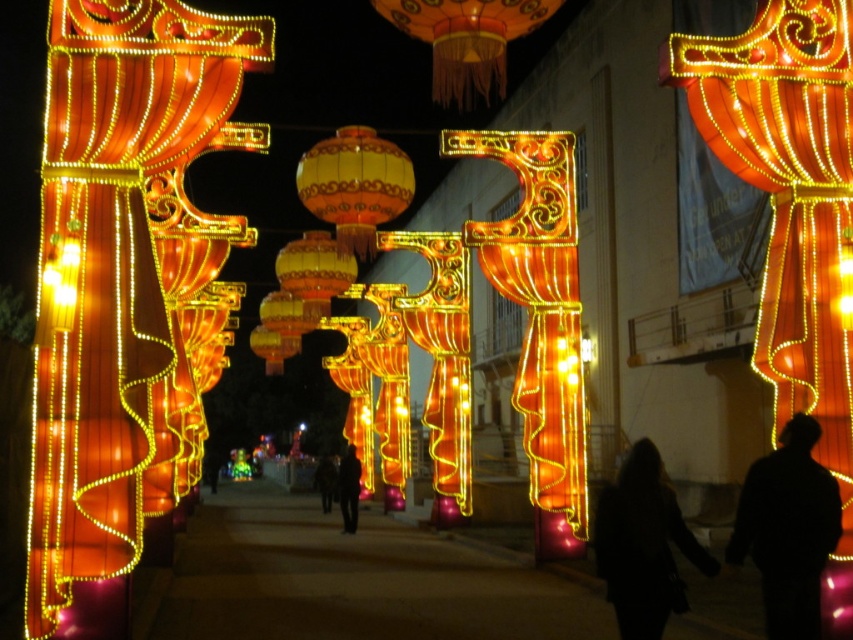
Is matte yellow lantern at center to the left of dark clothing figure at center from the viewer's perspective?

In fact, matte yellow lantern at center is to the right of dark clothing figure at center.

Does matte yellow lantern at center have a larger size compared to dark clothing figure at center?

No.

Describe the element at coordinates (355, 186) in the screenshot. This screenshot has width=853, height=640. I see `matte yellow lantern at center` at that location.

This screenshot has width=853, height=640. In order to click on matte yellow lantern at center in this screenshot , I will do `click(355, 186)`.

Can you confirm if matte orange fabric lantern at left is positioned to the right of matte orange lantern at center?

Incorrect, matte orange fabric lantern at left is not on the right side of matte orange lantern at center.

Does matte orange fabric lantern at left have a greater width compared to matte orange lantern at center?

Yes, matte orange fabric lantern at left is wider than matte orange lantern at center.

Find the location of a particular element. matte orange fabric lantern at left is located at coordinates (109, 266).

Between point (426, 42) and point (355, 189), which one is positioned behind?

The point (355, 189) is behind.

Is the position of matte orange paper lantern at upper center less distant than that of matte yellow lantern at center?

Yes.

Which is in front, point (469, 49) or point (366, 204)?

Point (469, 49) is more forward.

Find the location of a particular element. matte orange paper lantern at upper center is located at coordinates (466, 40).